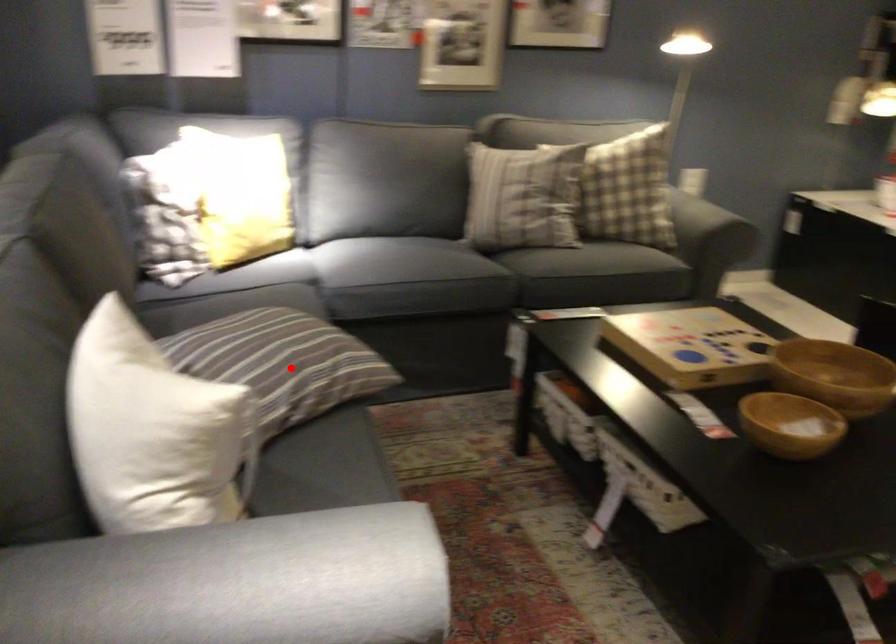
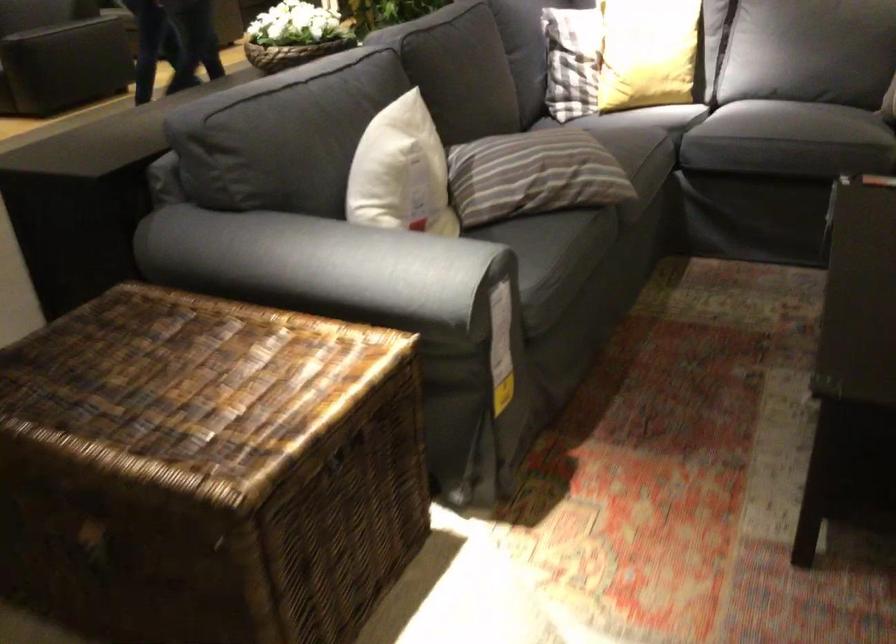
The point at the highlighted location is marked in the first image. Where is the corresponding point in the second image?

(533, 174)